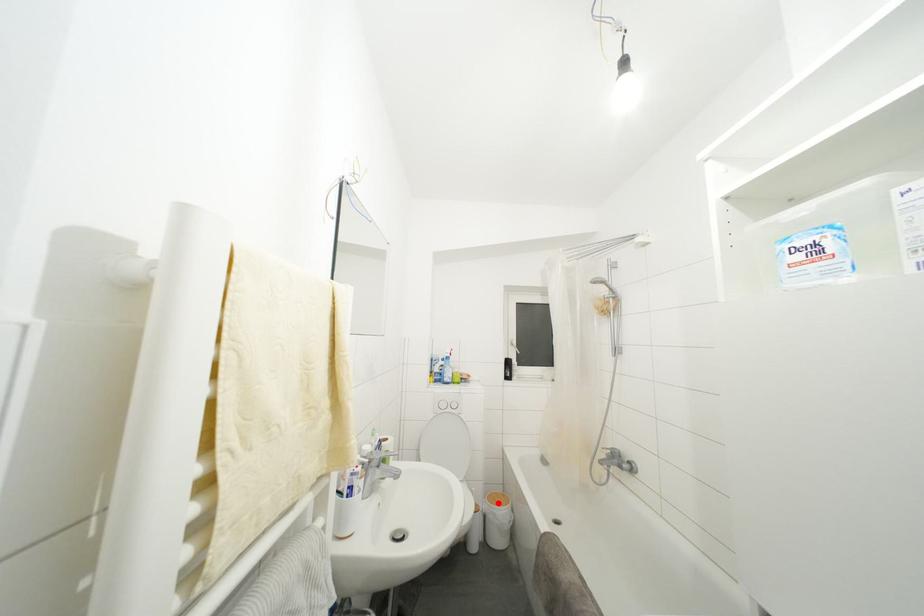
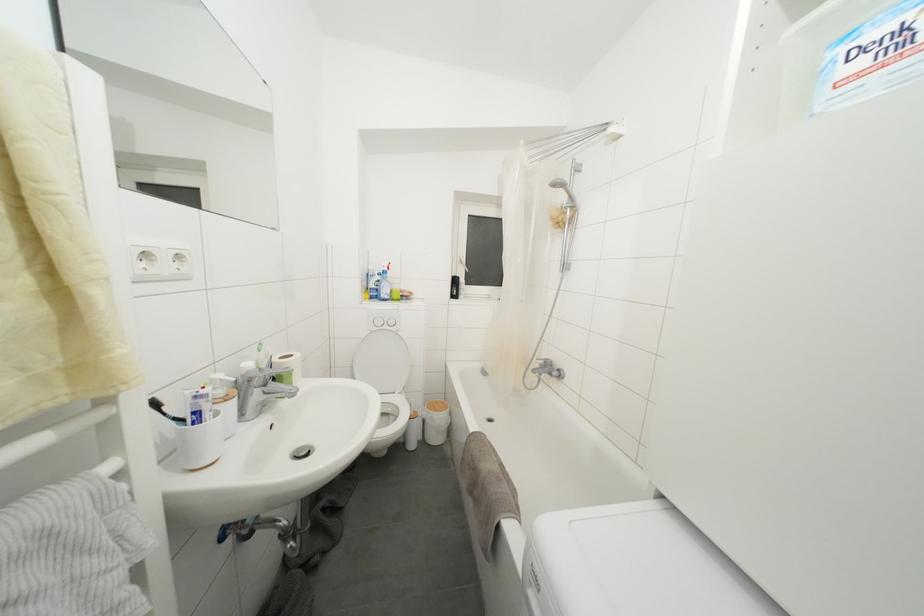
Question: I am providing you with two images of the same scene from different viewpoints. Image1 has a red point marked. In image2, the corresponding 3D location appears at what relative position? Reply with the corresponding letter.

Choices:
 (A) Closer
 (B) Farther

Answer: (A)